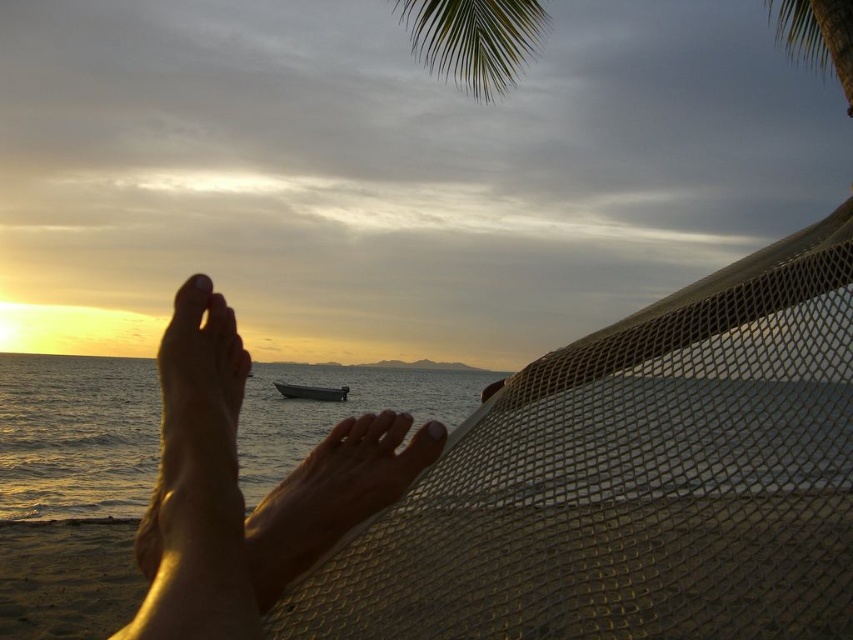
Question: Is golden water at lower left closer to the viewer compared to dark gray matte boat at center?

Choices:
 (A) yes
 (B) no

Answer: (A)

Question: Considering the real-world distances, which object is farthest from the dark gray matte boat at center?

Choices:
 (A) green leafy palm at upper center
 (B) golden water at lower left
 (C) matte skin foot at lower left

Answer: (C)

Question: Estimate the real-world distances between objects in this image. Which object is closer to the smooth skin at center?

Choices:
 (A) matte skin foot at lower left
 (B) dark gray matte boat at center

Answer: (A)

Question: Can you confirm if green leafy palm tree at upper right is positioned to the right of dark gray matte boat at center?

Choices:
 (A) no
 (B) yes

Answer: (B)

Question: From the image, what is the correct spatial relationship of skinny bare feet at lower left in relation to golden water at lower left?

Choices:
 (A) above
 (B) below

Answer: (A)

Question: Which point appears farthest from the camera in this image?

Choices:
 (A) (207, 285)
 (B) (149, 364)
 (C) (796, 54)
 (D) (303, 394)

Answer: (B)